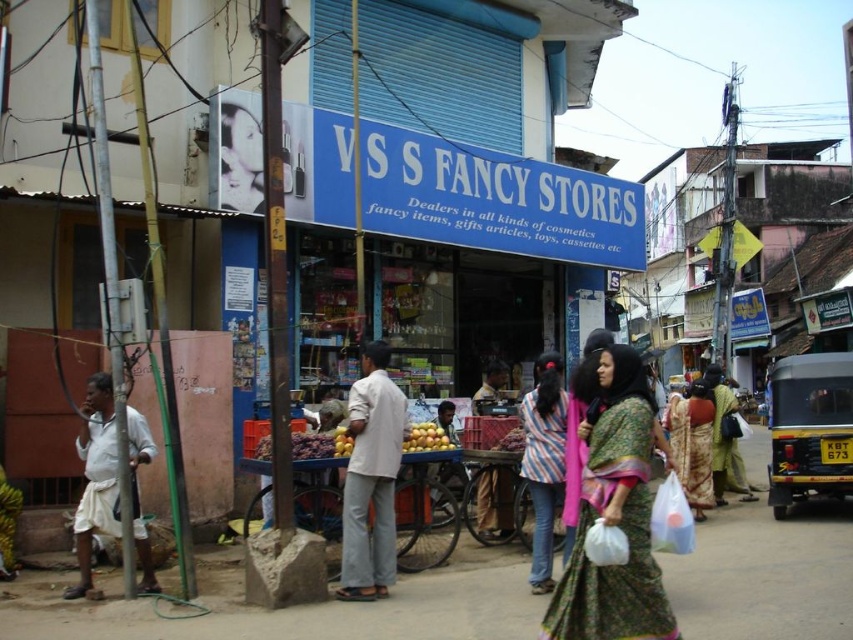
Question: Which point appears farthest from the camera in this image?

Choices:
 (A) (695, 445)
 (B) (421, 445)
 (C) (721, 388)
 (D) (550, 449)

Answer: (C)

Question: Considering the real-world distances, which object is closest to the white cloth at left?

Choices:
 (A) striped fabric shirt at center
 (B) green floral saree at center
 (C) shiny purple grapes at center
 (D) light beige cotton shirt at center

Answer: (C)

Question: Which point appears farthest from the camera in this image?

Choices:
 (A) (293, 449)
 (B) (436, 436)
 (C) (596, 435)
 (D) (704, 468)

Answer: (D)

Question: Can you confirm if green floral saree at center is positioned to the right of yellow matte oranges at center?

Choices:
 (A) no
 (B) yes

Answer: (B)

Question: Is green printed sari at center wider than white cloth at left?

Choices:
 (A) no
 (B) yes

Answer: (B)

Question: Does green printed sari at center lie behind striped fabric shirt at center?

Choices:
 (A) yes
 (B) no

Answer: (B)